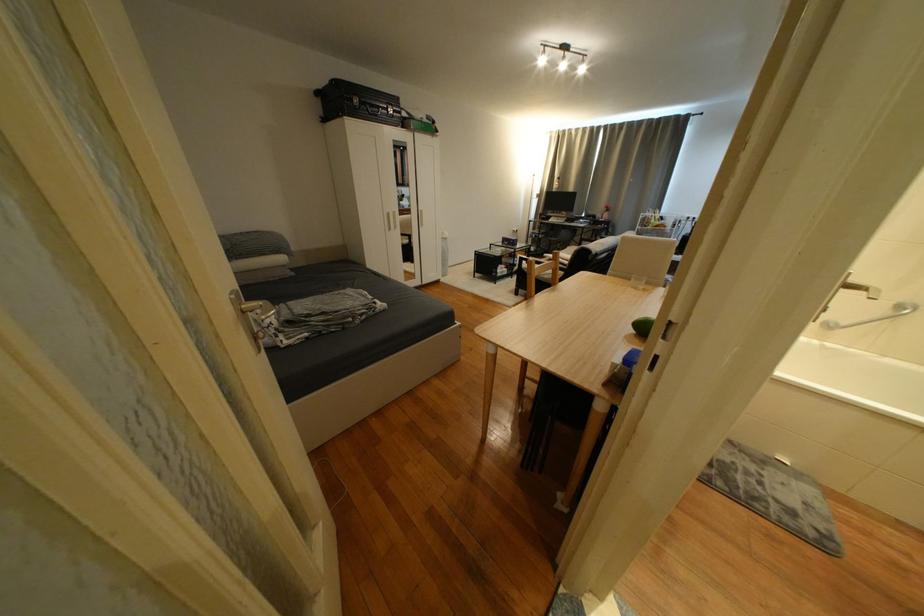
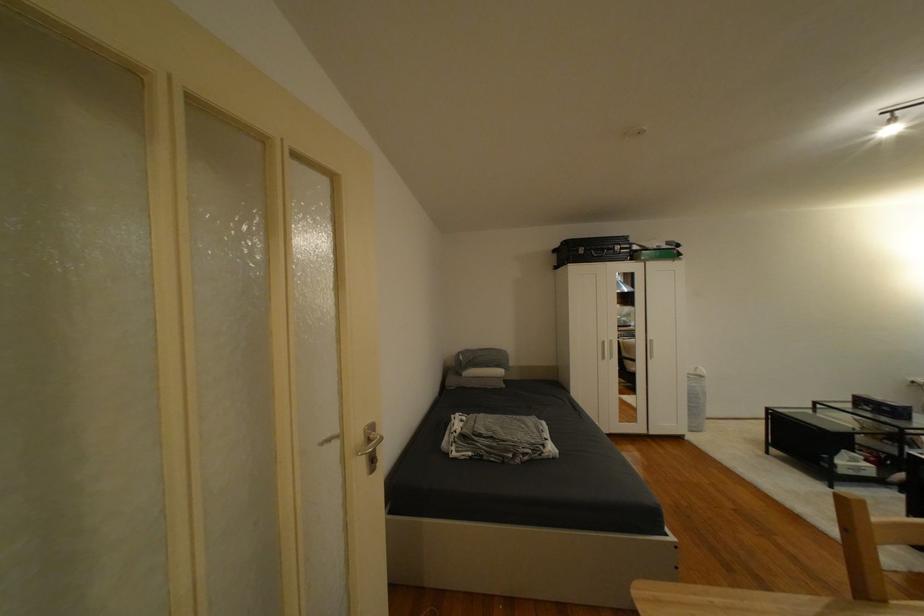
Locate, in the second image, the point that corresponds to point (332, 314) in the first image.

(500, 439)